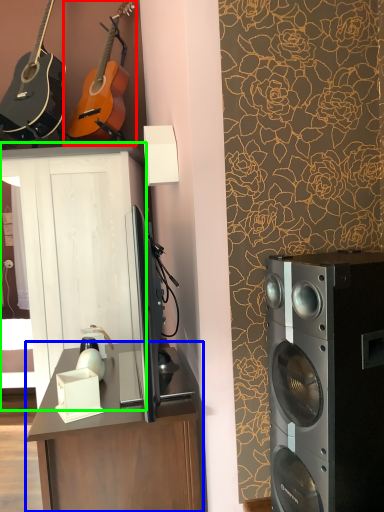
Question: Which is nearer to the guitar (highlighted by a red box)? desk (highlighted by a blue box) or cabinetry (highlighted by a green box).

Choices:
 (A) desk
 (B) cabinetry

Answer: (B)